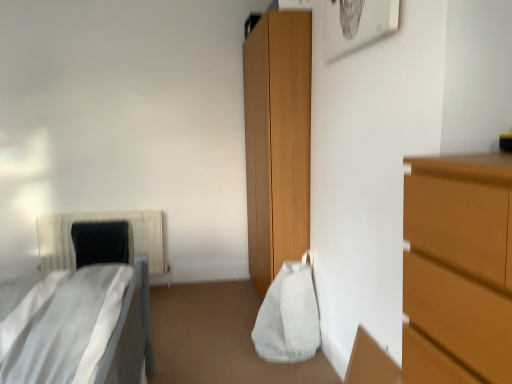
Question: Is white fabric bed at left at the left side of black fabric pillow at left?

Choices:
 (A) yes
 (B) no

Answer: (B)

Question: Can you confirm if white fabric bed at left is wider than black fabric pillow at left?

Choices:
 (A) yes
 (B) no

Answer: (A)

Question: Is white fabric bed at left next to black fabric pillow at left?

Choices:
 (A) no
 (B) yes

Answer: (A)

Question: From a real-world perspective, does white fabric bed at left sit lower than black fabric pillow at left?

Choices:
 (A) no
 (B) yes

Answer: (A)

Question: Does white fabric bed at left come in front of black fabric pillow at left?

Choices:
 (A) no
 (B) yes

Answer: (B)

Question: Is white fabric bed at left to the left or to the right of white fabric bag at center in the image?

Choices:
 (A) left
 (B) right

Answer: (A)

Question: Is white fabric bed at left situated inside white fabric bag at center or outside?

Choices:
 (A) inside
 (B) outside

Answer: (B)

Question: From the image's perspective, relative to white fabric bag at center, is white fabric bed at left above or below?

Choices:
 (A) below
 (B) above

Answer: (B)

Question: From their relative heights in the image, would you say white fabric bed at left is taller or shorter than white fabric bag at center?

Choices:
 (A) short
 (B) tall

Answer: (B)

Question: Is white textured radiator at left wider or thinner than white fabric bag at center?

Choices:
 (A) wide
 (B) thin

Answer: (B)

Question: From the image's perspective, is white textured radiator at left positioned above or below white fabric bag at center?

Choices:
 (A) above
 (B) below

Answer: (A)

Question: Would you say white textured radiator at left is to the left or to the right of white fabric bag at center in the picture?

Choices:
 (A) right
 (B) left

Answer: (B)

Question: From a real-world perspective, relative to white fabric bag at center, is white textured radiator at left vertically above or below?

Choices:
 (A) above
 (B) below

Answer: (A)

Question: Is white fabric bag at center inside or outside of white fabric bed at left?

Choices:
 (A) inside
 (B) outside

Answer: (B)

Question: Considering the positions of point (296, 281) and point (34, 324), is point (296, 281) closer or farther from the camera than point (34, 324)?

Choices:
 (A) farther
 (B) closer

Answer: (A)